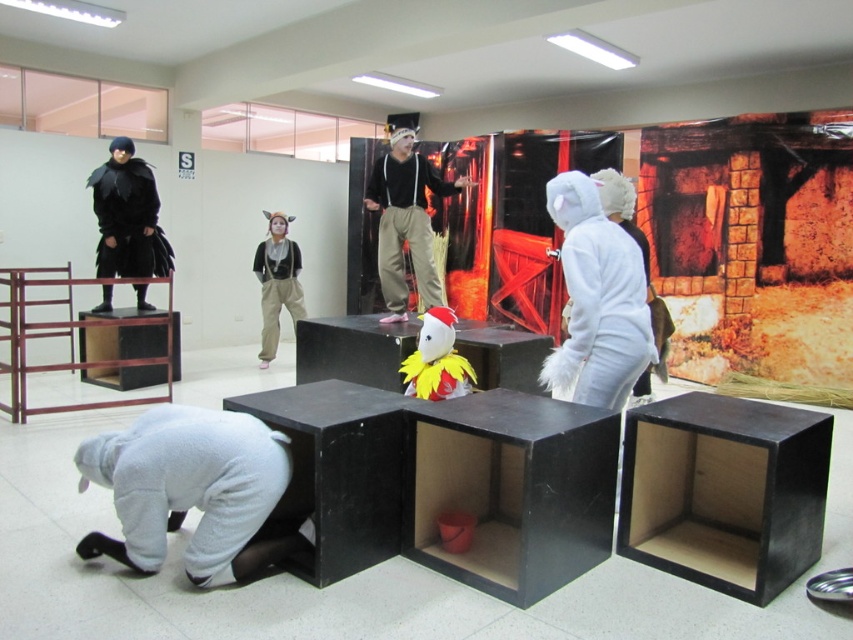
You are organizing a costume party and need to arrange the white furry costume at right and the black matte clothing at upper left in a small storage room. Based on their sizes, which costume should you place first to maximize space efficiency?

The white furry costume at right occupies less space than the black matte clothing at upper left, so you should place the black matte clothing at upper left first to maximize space efficiency by utilizing the larger space first.

You are a photographer positioned at the entrance of the room. You want to take a photo of the white furry costume at right and the fluffy yellow and red costume at center without any obstructions. Based on their positions, which costume should you adjust to ensure both are visible in the frame?

The white furry costume at right is in front of the fluffy yellow and red costume at center, so you should move the white furry costume at right backward to avoid blocking the view of the fluffy yellow and red costume at center.